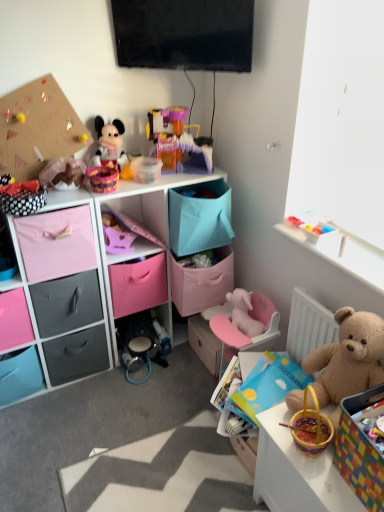
At what (x,y) coordinates should I click in order to perform the action: click on free space in front of pink fabric drawer at lower left, which appears as the seventh drawer when viewed from the right. Please return your answer as a coordinate pair (x, y). This screenshot has width=384, height=512. Looking at the image, I should click on [25, 430].